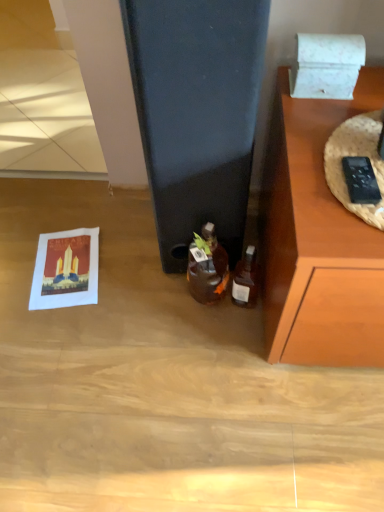
What do you see at coordinates (326, 65) in the screenshot?
I see `white marble box at upper right` at bounding box center [326, 65].

What do you see at coordinates (361, 180) in the screenshot? The height and width of the screenshot is (512, 384). I see `black plastic remote control at right` at bounding box center [361, 180].

Locate an element on the screen. translucent glass bottle at center, positioned as the 1th bottle in left-to-right order is located at coordinates pos(207,266).

Is translucent glass bottle at center, positioned as the 1th bottle in left-to-right order, facing away from translucent glass bottle at lower right, which ranks as the 1th bottle in right-to-left order?

No.

Can you tell me how much translucent glass bottle at center, marked as the second bottle in a right-to-left arrangement, and translucent glass bottle at lower right, which ranks as the 1th bottle in right-to-left order, differ in facing direction?

The facing directions of translucent glass bottle at center, marked as the second bottle in a right-to-left arrangement, and translucent glass bottle at lower right, which ranks as the 1th bottle in right-to-left order, are 0.00137 degrees apart.

From a real-world perspective, between translucent glass bottle at center, marked as the second bottle in a right-to-left arrangement, and translucent glass bottle at lower right, the 2th bottle when ordered from left to right, who is vertically lower?

translucent glass bottle at lower right, the 2th bottle when ordered from left to right, is physically lower.

Consider the image. Can you confirm if translucent glass bottle at center, marked as the second bottle in a right-to-left arrangement, is thinner than translucent glass bottle at lower right, the 2th bottle when ordered from left to right?

No, translucent glass bottle at center, marked as the second bottle in a right-to-left arrangement, is not thinner than translucent glass bottle at lower right, the 2th bottle when ordered from left to right.

From the black plastic remote control at right, count the 1st bottle to the left and point to it. Please provide its 2D coordinates.

[(246, 279)]

Is black plastic remote control at right turned away from translucent glass bottle at lower right, the 2th bottle when ordered from left to right?

No.

Is black plastic remote control at right shorter than translucent glass bottle at lower right, the 2th bottle when ordered from left to right?

Indeed, black plastic remote control at right has a lesser height compared to translucent glass bottle at lower right, the 2th bottle when ordered from left to right.

Is matte paper postcard at lower left inside or outside of translucent glass bottle at lower right, the 2th bottle when ordered from left to right?

matte paper postcard at lower left lies outside translucent glass bottle at lower right, the 2th bottle when ordered from left to right.

From the image's perspective, is matte paper postcard at lower left located above or below translucent glass bottle at lower right, which ranks as the 1th bottle in right-to-left order?

matte paper postcard at lower left is situated higher than translucent glass bottle at lower right, which ranks as the 1th bottle in right-to-left order, in the image.

Where is `postcard that appears on the left of translucent glass bottle at lower right, the 2th bottle when ordered from left to right`? postcard that appears on the left of translucent glass bottle at lower right, the 2th bottle when ordered from left to right is located at coordinates (66, 269).

Can you confirm if matte paper postcard at lower left is positioned to the right of translucent glass bottle at lower right, the 2th bottle when ordered from left to right?

No, matte paper postcard at lower left is not to the right of translucent glass bottle at lower right, the 2th bottle when ordered from left to right.

Would you consider black plastic remote control at right to be distant from translucent glass bottle at center, positioned as the 1th bottle in left-to-right order?

They are positioned close to each other.

Can you tell me how much black plastic remote control at right and translucent glass bottle at center, positioned as the 1th bottle in left-to-right order, differ in facing direction?

They differ by 1.91 degrees in their facing directions.

Is black plastic remote control at right positioned with its back to translucent glass bottle at center, marked as the second bottle in a right-to-left arrangement?

No.

Based on the photo, would you say translucent glass bottle at center, marked as the second bottle in a right-to-left arrangement, is part of black plastic remote control at right's contents?

That's incorrect, translucent glass bottle at center, marked as the second bottle in a right-to-left arrangement, is not inside black plastic remote control at right.

How many degrees apart are the facing directions of matte paper postcard at lower left and black plastic remote control at right?

There is a 174-degree angle between the facing directions of matte paper postcard at lower left and black plastic remote control at right.

Is matte paper postcard at lower left turned away from black plastic remote control at right?

That's not correct — matte paper postcard at lower left is not looking away from black plastic remote control at right.

From a real-world perspective, is matte paper postcard at lower left physically located above or below black plastic remote control at right?

From a real-world perspective, matte paper postcard at lower left is physically below black plastic remote control at right.

Between matte paper postcard at lower left and black plastic remote control at right, which one has larger width?

matte paper postcard at lower left is wider.

Could you tell me if matte paper postcard at lower left is turned towards translucent glass bottle at center, marked as the second bottle in a right-to-left arrangement?

No, matte paper postcard at lower left is not turned towards translucent glass bottle at center, marked as the second bottle in a right-to-left arrangement.

Is matte paper postcard at lower left bigger or smaller than translucent glass bottle at center, positioned as the 1th bottle in left-to-right order?

In the image, matte paper postcard at lower left appears to be larger than translucent glass bottle at center, positioned as the 1th bottle in left-to-right order.

Does matte paper postcard at lower left have a greater height compared to translucent glass bottle at center, marked as the second bottle in a right-to-left arrangement?

No.

Are matte paper postcard at lower left and translucent glass bottle at center, positioned as the 1th bottle in left-to-right order, located far from each other?

No, matte paper postcard at lower left is not far away from translucent glass bottle at center, positioned as the 1th bottle in left-to-right order.

Relative to translucent glass bottle at lower right, which ranks as the 1th bottle in right-to-left order, is white marble box at upper right in front or behind?

In the image, white marble box at upper right appears in front of translucent glass bottle at lower right, which ranks as the 1th bottle in right-to-left order.

Could you tell me if white marble box at upper right is facing translucent glass bottle at lower right, the 2th bottle when ordered from left to right?

No, white marble box at upper right is not oriented towards translucent glass bottle at lower right, the 2th bottle when ordered from left to right.

Does white marble box at upper right contain translucent glass bottle at lower right, the 2th bottle when ordered from left to right?

No, white marble box at upper right does not contain translucent glass bottle at lower right, the 2th bottle when ordered from left to right.

Is point (353, 50) less distant than point (249, 286)?

Yes, it is in front of point (249, 286).

The height and width of the screenshot is (512, 384). What are the coordinates of `bottle above the translucent glass bottle at lower right, the 2th bottle when ordered from left to right (from a real-world perspective)` in the screenshot? It's located at (207, 266).

From a real-world perspective, count 2nd bottles downward from the black plastic remote control at right and point to it. Please provide its 2D coordinates.

[(246, 279)]

Estimate the real-world distances between objects in this image. Which object is further from translucent glass bottle at lower right, which ranks as the 1th bottle in right-to-left order, black plastic remote control at right or matte paper postcard at lower left?

matte paper postcard at lower left is positioned further to the anchor translucent glass bottle at lower right, which ranks as the 1th bottle in right-to-left order.

Which object lies nearer to the anchor point translucent glass bottle at lower right, which ranks as the 1th bottle in right-to-left order, translucent glass bottle at center, positioned as the 1th bottle in left-to-right order, or matte paper postcard at lower left?

Among the two, translucent glass bottle at center, positioned as the 1th bottle in left-to-right order, is located nearer to translucent glass bottle at lower right, which ranks as the 1th bottle in right-to-left order.

Estimate the real-world distances between objects in this image. Which object is closer to black plastic remote control at right, translucent glass bottle at center, marked as the second bottle in a right-to-left arrangement, or white marble box at upper right?

white marble box at upper right lies closer to black plastic remote control at right than the other object.

Estimate the real-world distances between objects in this image. Which object is closer to translucent glass bottle at lower right, which ranks as the 1th bottle in right-to-left order, translucent glass bottle at center, positioned as the 1th bottle in left-to-right order, or black plastic remote control at right?

Based on the image, translucent glass bottle at center, positioned as the 1th bottle in left-to-right order, appears to be nearer to translucent glass bottle at lower right, which ranks as the 1th bottle in right-to-left order.

Which object lies further to the anchor point translucent glass bottle at center, marked as the second bottle in a right-to-left arrangement, black plastic remote control at right or translucent glass bottle at lower right, which ranks as the 1th bottle in right-to-left order?

black plastic remote control at right is positioned further to the anchor translucent glass bottle at center, marked as the second bottle in a right-to-left arrangement.

Estimate the real-world distances between objects in this image. Which object is closer to black plastic remote control at right, translucent glass bottle at center, marked as the second bottle in a right-to-left arrangement, or matte paper postcard at lower left?

Based on the image, translucent glass bottle at center, marked as the second bottle in a right-to-left arrangement, appears to be nearer to black plastic remote control at right.

When comparing their distances from translucent glass bottle at lower right, which ranks as the 1th bottle in right-to-left order, does matte paper postcard at lower left or black plastic remote control at right seem closer?

Among the two, black plastic remote control at right is located nearer to translucent glass bottle at lower right, which ranks as the 1th bottle in right-to-left order.

From the image, which object appears to be farther from translucent glass bottle at lower right, the 2th bottle when ordered from left to right, white marble box at upper right or translucent glass bottle at center, positioned as the 1th bottle in left-to-right order?

white marble box at upper right.

In order to click on bottle between white marble box at upper right and translucent glass bottle at lower right, the 2th bottle when ordered from left to right, in the vertical direction in this screenshot , I will do `click(207, 266)`.

Where is `remote control between white marble box at upper right and translucent glass bottle at lower right, the 2th bottle when ordered from left to right, in the vertical direction`? The height and width of the screenshot is (512, 384). remote control between white marble box at upper right and translucent glass bottle at lower right, the 2th bottle when ordered from left to right, in the vertical direction is located at coordinates (361, 180).

At what (x,y) coordinates should I click in order to perform the action: click on bottle between black plastic remote control at right and translucent glass bottle at lower right, which ranks as the 1th bottle in right-to-left order, in the front-back direction. Please return your answer as a coordinate pair (x, y). This screenshot has height=512, width=384. Looking at the image, I should click on (207, 266).

Locate an element on the screen. The height and width of the screenshot is (512, 384). remote control between white marble box at upper right and translucent glass bottle at center, marked as the second bottle in a right-to-left arrangement, in the vertical direction is located at coordinates (361, 180).